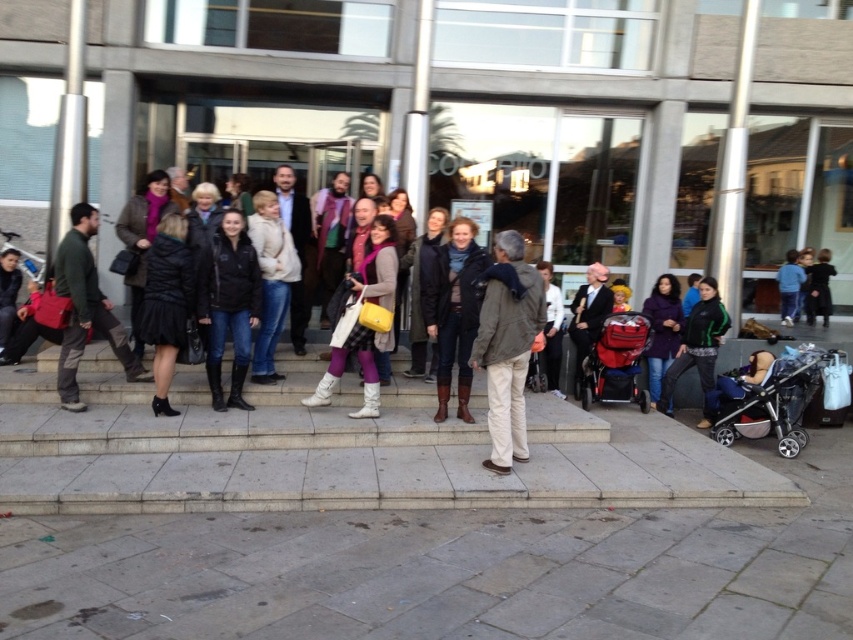
Between matte black jacket at center and purple matte jacket at center, which one has less height?

Standing shorter between the two is purple matte jacket at center.

Which is below, matte black jacket at center or purple matte jacket at center?

purple matte jacket at center is lower down.

Describe the element at coordinates (228, 305) in the screenshot. This screenshot has height=640, width=853. I see `matte black jacket at center` at that location.

Where is `matte black jacket at center`? matte black jacket at center is located at coordinates (228, 305).

Which is below, leather boots at center or black velvet dress at center?

leather boots at center is lower down.

Does leather boots at center come behind black velvet dress at center?

No, leather boots at center is in front of black velvet dress at center.

Is point (463, 259) farther from camera compared to point (828, 288)?

No.

Where is `leather boots at center`? leather boots at center is located at coordinates (453, 310).

Can you confirm if black leather skirt at center is positioned to the left of purple matte jacket at center?

Yes, black leather skirt at center is to the left of purple matte jacket at center.

Describe the element at coordinates (166, 301) in the screenshot. I see `black leather skirt at center` at that location.

Where is `black leather skirt at center`? This screenshot has width=853, height=640. black leather skirt at center is located at coordinates (166, 301).